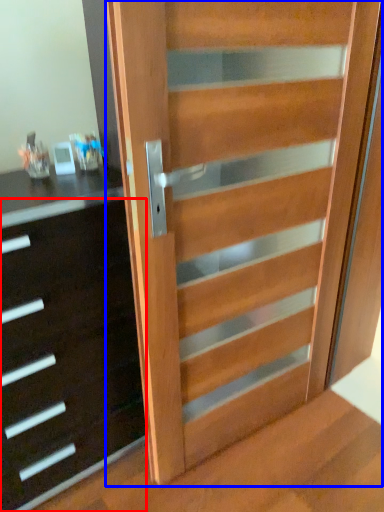
Question: Among these objects, which one is nearest to the camera, chest of drawers (highlighted by a red box) or door (highlighted by a blue box)?

Choices:
 (A) chest of drawers
 (B) door

Answer: (B)